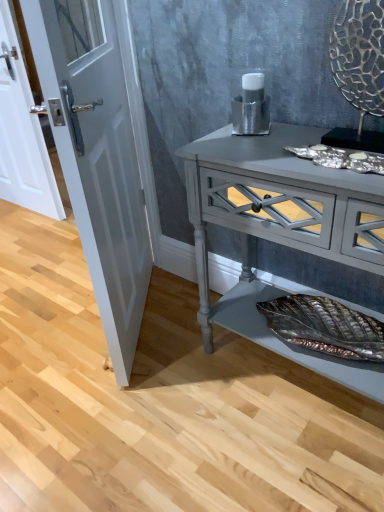
The height and width of the screenshot is (512, 384). Find the location of `vacant area in front of white glossy door at left, arranged as the first door when viewed from the right`. vacant area in front of white glossy door at left, arranged as the first door when viewed from the right is located at coordinates click(131, 406).